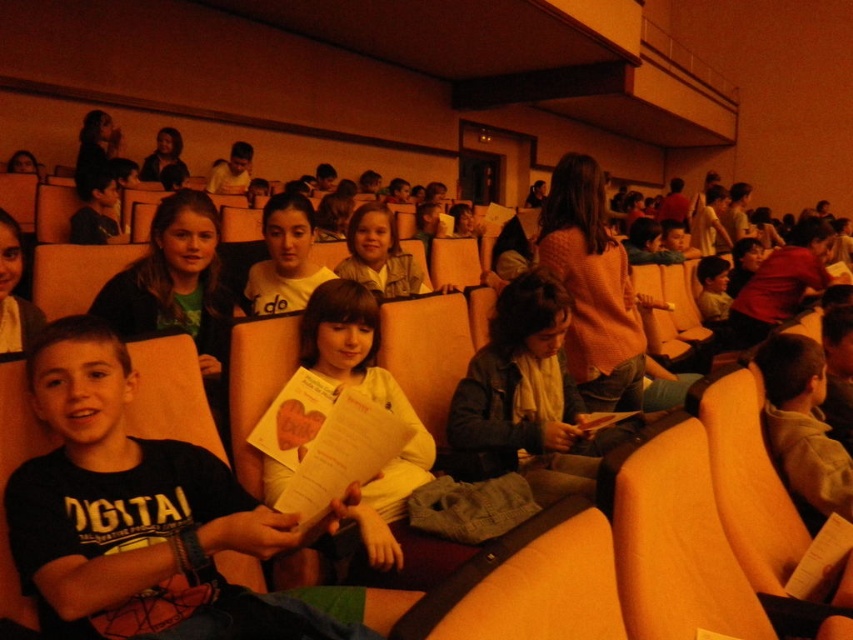
From the picture: You are a photographer trying to capture a closeup of the matte green shirt at center and the matte black jacket at upper left. Given that your camera can only focus on objects within a 1 meter range, can you adjust your position so that both are within the focus range?

The matte green shirt at center is smaller than the matte black jacket at upper left, which suggests it is farther away. To have both within the 1 meter focus range, you would need to move closer to the matte green shirt at center so that the distance between you and both objects is within 1 meter.

You are a photographer setting up for a group photo in the auditorium. You want to ensure that both the matte green shirt at center and the matte black jacket at upper left are visible in the frame. Based on their positions, which one is closer to the bottom of the image?

The matte green shirt at center is below the matte black jacket at upper left, so it is closer to the bottom of the image.